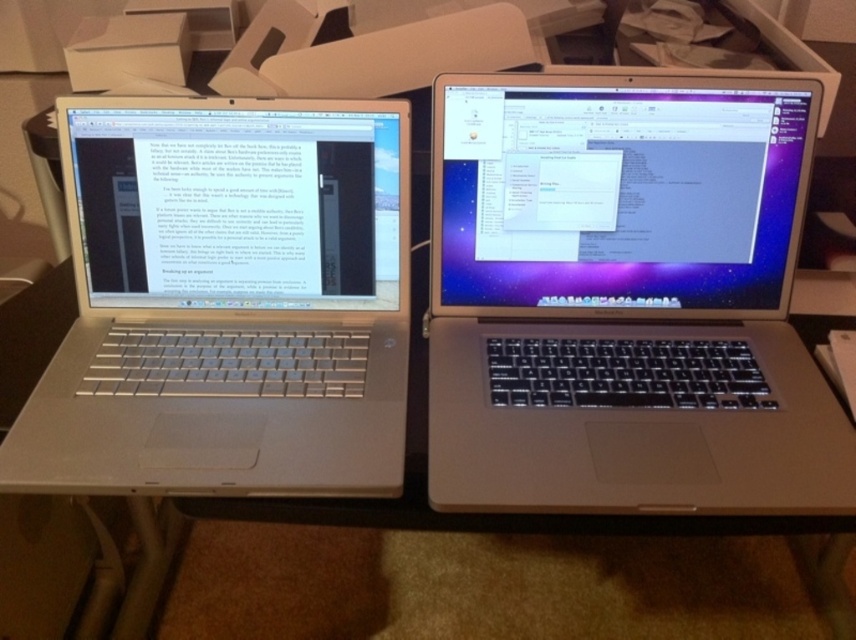
Question: Can you confirm if silver metallic laptop at left is positioned below silver metallic desk at center?

Choices:
 (A) no
 (B) yes

Answer: (A)

Question: Can you confirm if satin silver laptop at center is smaller than silver metallic desk at center?

Choices:
 (A) no
 (B) yes

Answer: (B)

Question: Which of the following is the closest to the observer?

Choices:
 (A) (679, 323)
 (B) (278, 198)

Answer: (B)

Question: Which object appears closest to the camera in this image?

Choices:
 (A) silver metallic desk at center
 (B) satin silver laptop at center
 (C) silver metallic laptop at left

Answer: (B)

Question: Where is satin silver laptop at center located in relation to silver metallic laptop at left in the image?

Choices:
 (A) left
 (B) right

Answer: (B)

Question: Which object is positioned farthest from the silver metallic laptop at left?

Choices:
 (A) satin silver laptop at center
 (B) silver metallic desk at center

Answer: (A)